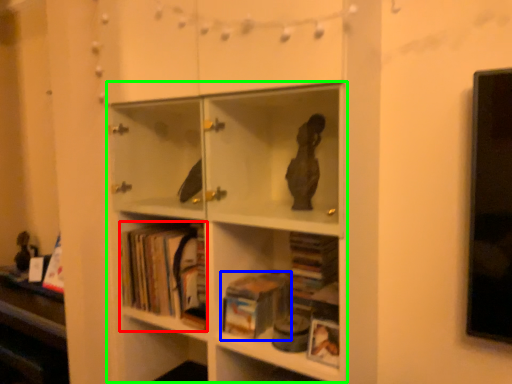
Question: Which is farther away from book (highlighted by a red box)? book (highlighted by a blue box) or bookcase (highlighted by a green box)?

Choices:
 (A) book
 (B) bookcase

Answer: (A)